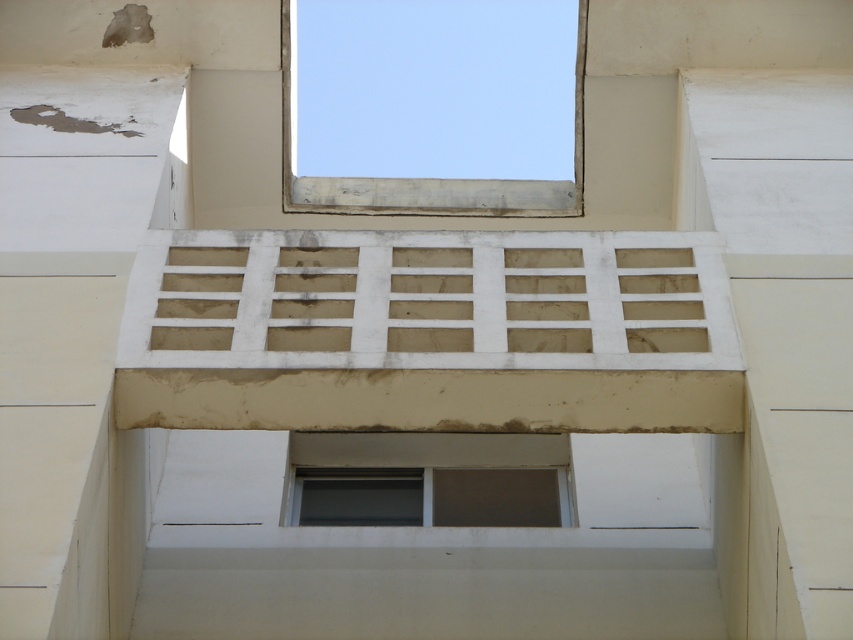
Question: Is clear glass window at upper center positioned behind matte gray window at center?

Choices:
 (A) no
 (B) yes

Answer: (B)

Question: Can you confirm if clear glass window at upper center is positioned below matte gray window at center?

Choices:
 (A) no
 (B) yes

Answer: (A)

Question: Is clear glass window at upper center closer to the viewer compared to matte gray window at center?

Choices:
 (A) yes
 (B) no

Answer: (B)

Question: Among these points, which one is farthest from the camera?

Choices:
 (A) (303, 32)
 (B) (486, 472)

Answer: (A)

Question: Which object is farther from the camera taking this photo?

Choices:
 (A) clear glass window at upper center
 (B) matte gray window at center

Answer: (A)